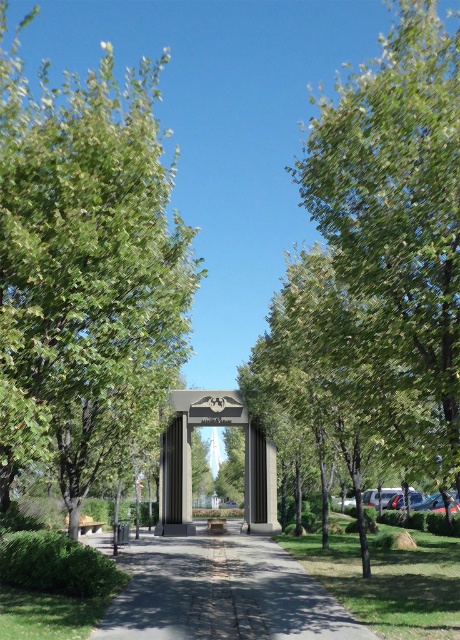
Question: Which point is closer to the camera taking this photo?

Choices:
 (A) (39, 320)
 (B) (329, 273)

Answer: (A)

Question: Can you confirm if green leafy tree at left is bigger than gray concrete pavement at center?

Choices:
 (A) no
 (B) yes

Answer: (B)

Question: Is green leafy tree at center behind gray concrete pavement at center?

Choices:
 (A) no
 (B) yes

Answer: (A)

Question: Can you confirm if green leafy tree at left is positioned below gray concrete pavement at center?

Choices:
 (A) no
 (B) yes

Answer: (A)

Question: Which point is closer to the camera?

Choices:
 (A) green leafy tree at center
 (B) green leafy tree at left

Answer: (B)

Question: Which is farther from the gray concrete pavement at center?

Choices:
 (A) green leafy tree at left
 (B) green leafy tree at center

Answer: (A)